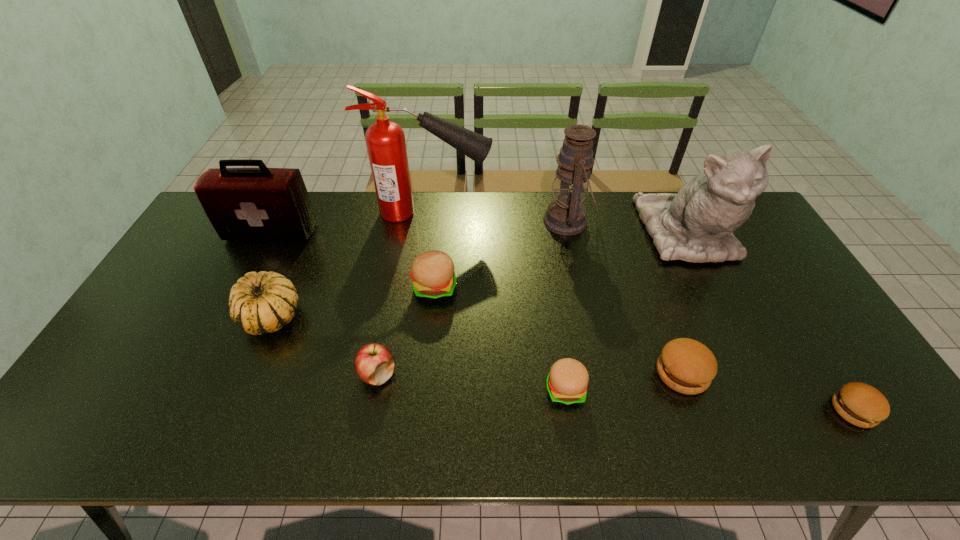
You are a GUI agent. You are given a task and a screenshot of the screen. Output one action in this format:
    pyautogui.click(x=<x>, y=<y>)
    Task: Click on the red fire extinguisher
    
    Given the screenshot: What is the action you would take?
    pyautogui.click(x=385, y=140)

Where is `cat`? cat is located at coordinates (696, 224).

Find the location of `blue oil lamp`. blue oil lamp is located at coordinates (566, 215).

The image size is (960, 540). Find the location of `the fourth tallest object`. the fourth tallest object is located at coordinates (243, 204).

The height and width of the screenshot is (540, 960). I want to click on the first aid kit, so click(243, 204).

Locate an element on the screen. This screenshot has height=540, width=960. white gourd is located at coordinates (263, 302).

This screenshot has height=540, width=960. I want to click on gourd, so click(x=263, y=302).

This screenshot has width=960, height=540. In order to click on the tallest hamburger in this screenshot , I will do `click(432, 272)`.

Locate an element on the screen. This screenshot has width=960, height=540. the left beige hamburger is located at coordinates (432, 272).

Where is `apple`? Image resolution: width=960 pixels, height=540 pixels. apple is located at coordinates (374, 363).